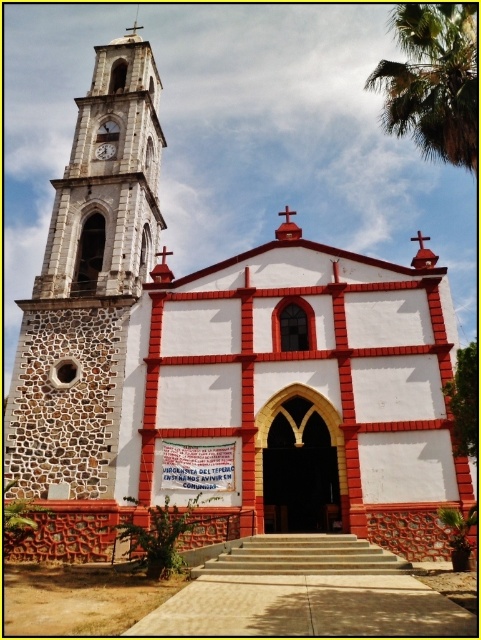
Where is `stone clock tower at left`? The width and height of the screenshot is (481, 640). stone clock tower at left is located at coordinates (88, 285).

Image resolution: width=481 pixels, height=640 pixels. What do you see at coordinates (88, 285) in the screenshot?
I see `stone clock tower at left` at bounding box center [88, 285].

Find the location of a particular element. The width and height of the screenshot is (481, 640). stone clock tower at left is located at coordinates (88, 285).

Is stone clock tower at left to the left of metallic clock at left from the viewer's perspective?

Correct, you'll find stone clock tower at left to the left of metallic clock at left.

Measure the distance between stone clock tower at left and metallic clock at left.

They are 16.83 meters apart.

What are the coordinates of `stone clock tower at left` in the screenshot? It's located at (88, 285).

Is point (455, 76) in front of point (100, 148)?

Yes, it is in front of point (100, 148).

Can you confirm if green leafy palm tree at upper right is bigger than metallic clock at left?

Yes, green leafy palm tree at upper right is bigger than metallic clock at left.

Locate an element on the screen. The width and height of the screenshot is (481, 640). green leafy palm tree at upper right is located at coordinates (432, 81).